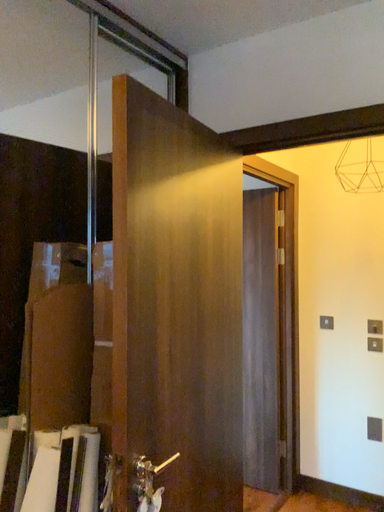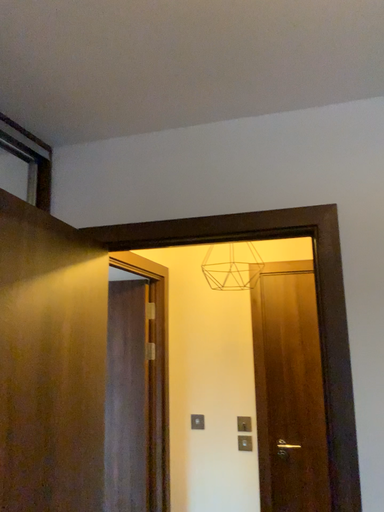
Question: How did the camera likely rotate when shooting the video?

Choices:
 (A) rotated right
 (B) rotated left

Answer: (A)